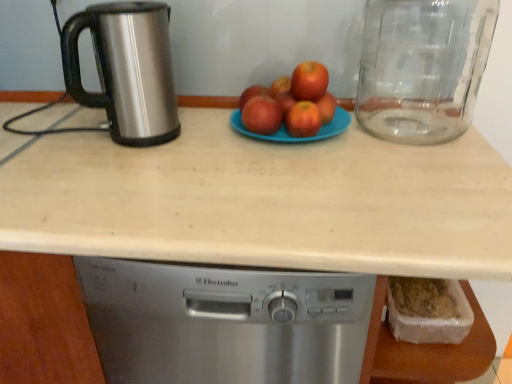
Question: Visually, is matte blue plate at center positioned to the left or to the right of stainless steel kettle at left?

Choices:
 (A) right
 (B) left

Answer: (A)

Question: Considering their positions, is matte blue plate at center located in front of or behind stainless steel kettle at left?

Choices:
 (A) behind
 (B) front

Answer: (A)

Question: Based on their relative distances, which object is farther from the red matte apple at center, which is the 5th apple in left-to-right order?

Choices:
 (A) matte blue plate at center
 (B) red matte apple at center, positioned as the first apple in right-to-left order
 (C) red matte apple at center, the third apple in the left-to-right sequence
 (D) red matte apples at center, marked as the 2th apple in a left-to-right arrangement
 (E) transparent glass jar at right

Answer: (E)

Question: Which object is positioned closest to the beige laminate countertop at center?

Choices:
 (A) red matte apple at center, which ranks as the 4th apple in right-to-left order
 (B) red matte apple at center, positioned as the first apple in right-to-left order
 (C) red matte apple at center, which ranks as the second apple in right-to-left order
 (D) red matte apple at center, arranged as the 1th apple when viewed from the left
 (E) matte blue plate at center

Answer: (E)